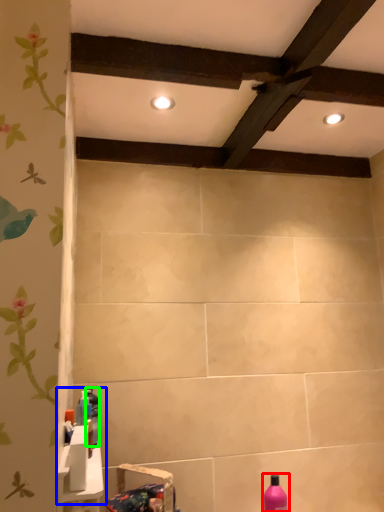
Question: Estimate the real-world distances between objects in this image. Which object is farther from bottle (highlighted by a red box), sink (highlighted by a blue box) or bottle (highlighted by a green box)?

Choices:
 (A) sink
 (B) bottle

Answer: (A)